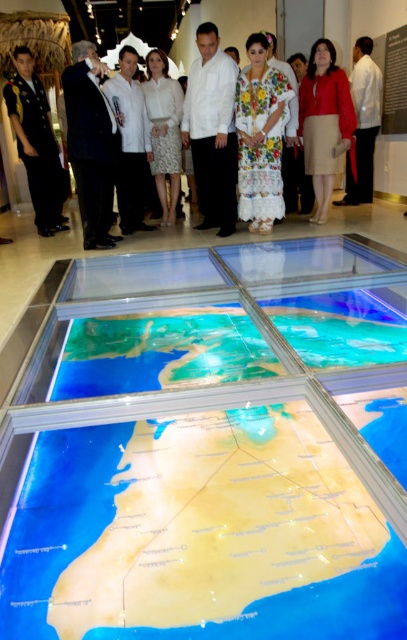
From the picture: You are a photographer positioned at the back of the exhibition space. You want to take a photo of the black suit at center and the white cotton dress at upper center without anyone blocking them. Which person should you focus on first to ensure they are in the frame?

The black suit at center is in front of the white cotton dress at upper center, so you should focus on the white cotton dress at upper center first to ensure it is visible behind the black suit at center.

You are standing at the exhibition space looking at the map on the floor. There are two points marked on the map at coordinates point (34,115) and point (4,124). Which point is closer to your current position?

Point (34,115) is closer to the camera than point (4,124), so the point (34,115) is closer to your current position.